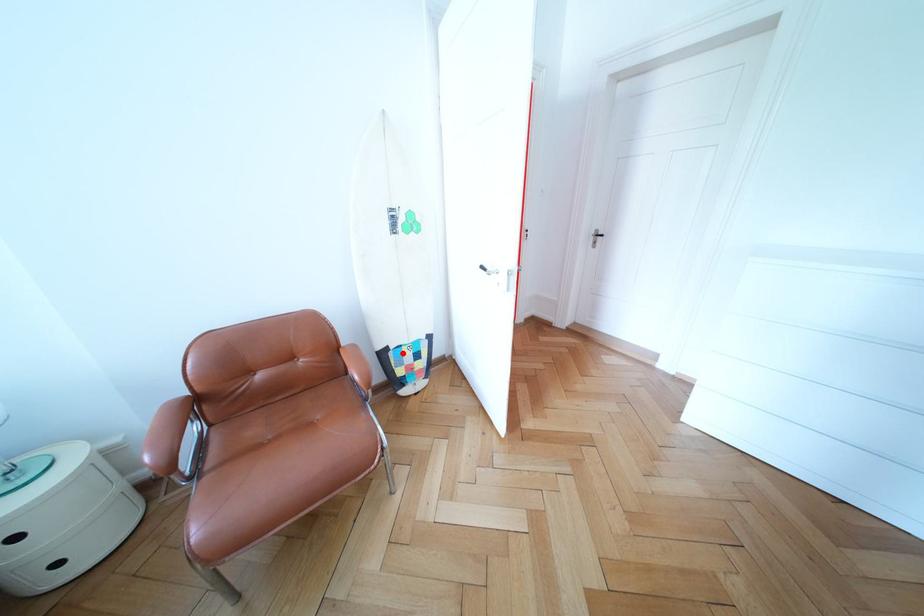
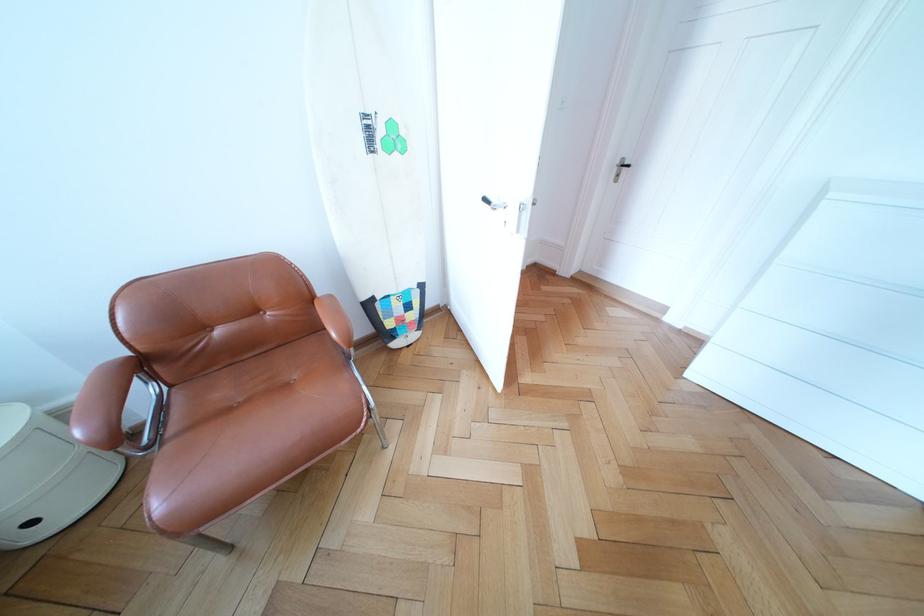
Find the pixel in the second image that matches the highlighted location in the first image.

(390, 304)